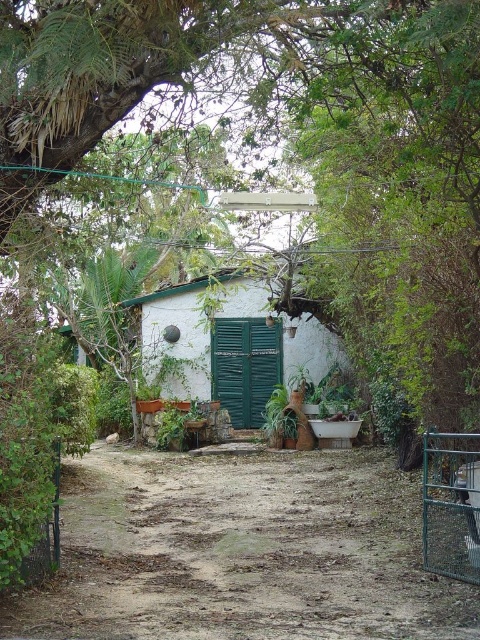
You are a delivery person trying to reach the small white building with green shutters. You see the dirt ground at center and the green metal gate at lower right. Which object is closer to you as you approach the building?

The dirt ground at center is closer to you because it is in front of the green metal gate at lower right, meaning the gate is further away from your current position.

You are a gardener planning to spread mulch evenly over the dirt ground at center and the metallic wire fence at lower left. Since you have limited mulch, which area requires more mulch to cover completely?

The dirt ground at center requires more mulch because it is larger in size than the metallic wire fence at lower left.

You are standing in front of the small white building with green shutters. You see two points marked in the image. The first point is at coordinates point (442, 624) and the second point is at point (37, 547). Which point is closer to you?

Point (442, 624) is closer to the camera than point (37, 547).